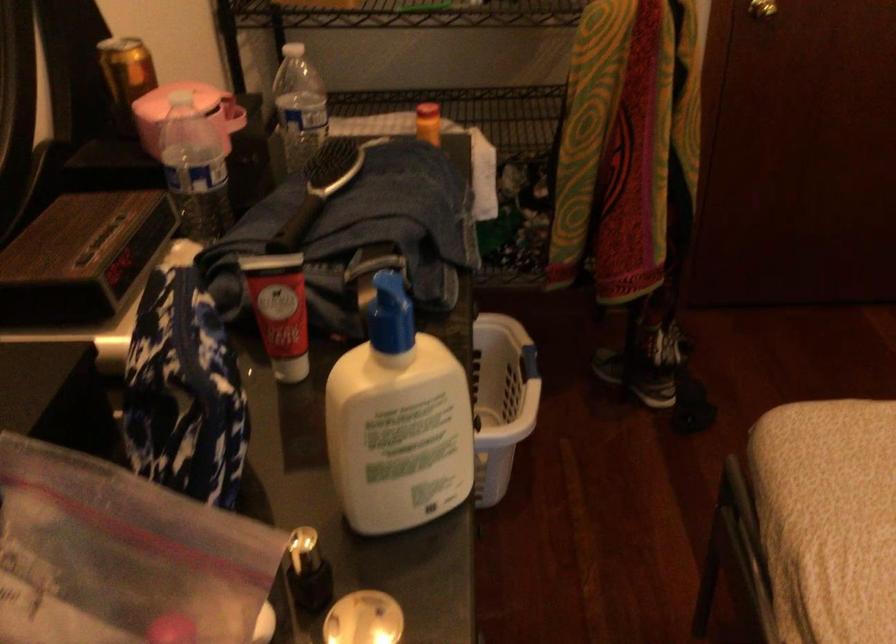
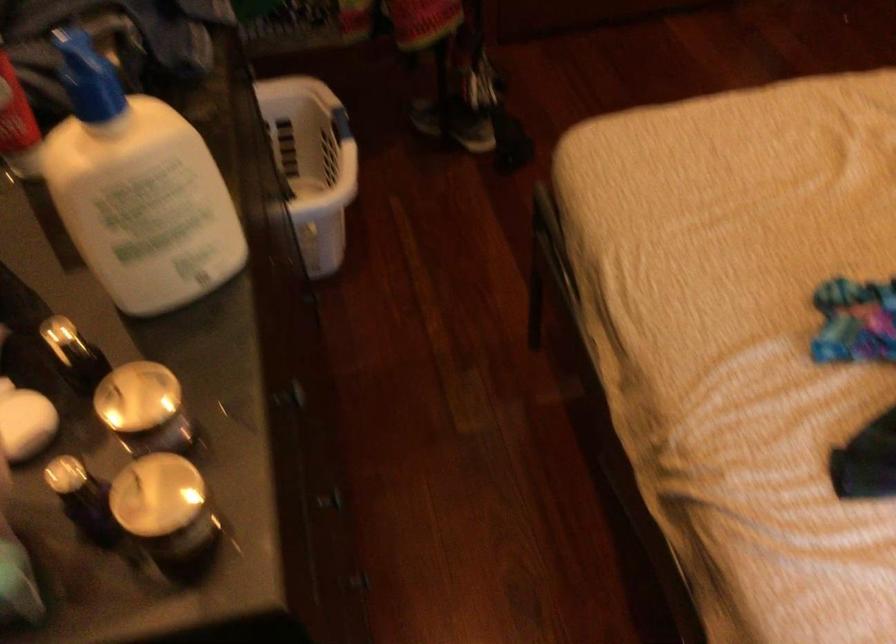
Question: The images are taken continuously from a first-person perspective. In which direction are you moving?

Choices:
 (A) Left
 (B) Right
 (C) Forward
 (D) Backward

Answer: (B)